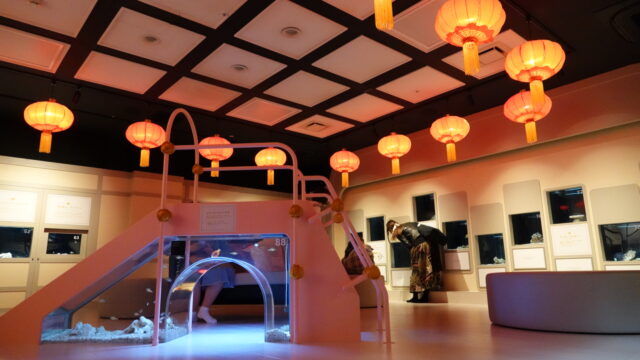
Locate an element on the screen. Image resolution: width=640 pixels, height=360 pixels. light is located at coordinates (285, 28).